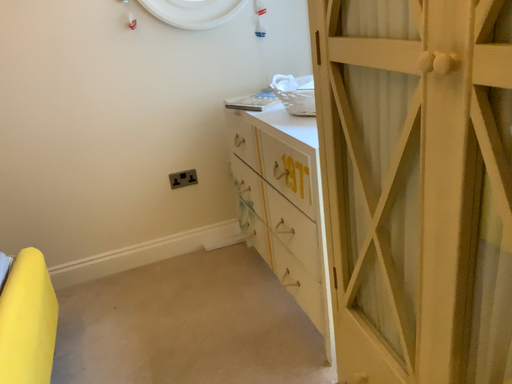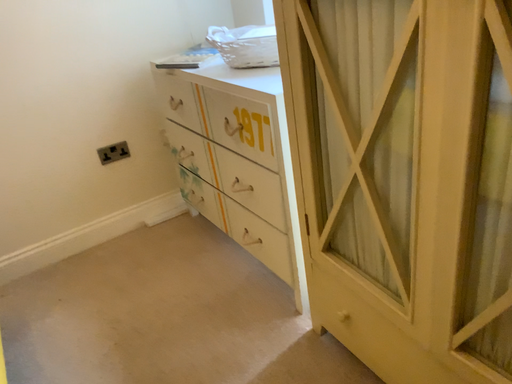
Question: How did the camera likely rotate when shooting the video?

Choices:
 (A) rotated left
 (B) rotated right

Answer: (B)